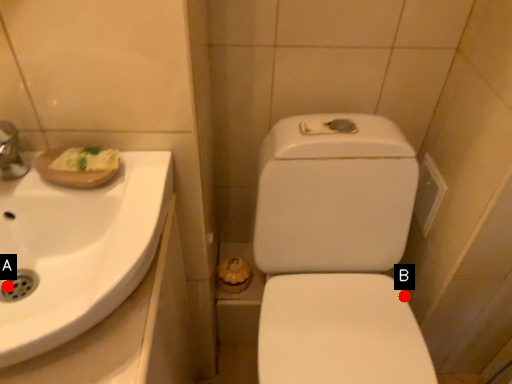
Question: Two points are circled on the image, labeled by A and B beside each circle. Which point is further to the camera?

Choices:
 (A) A is further
 (B) B is further

Answer: (B)